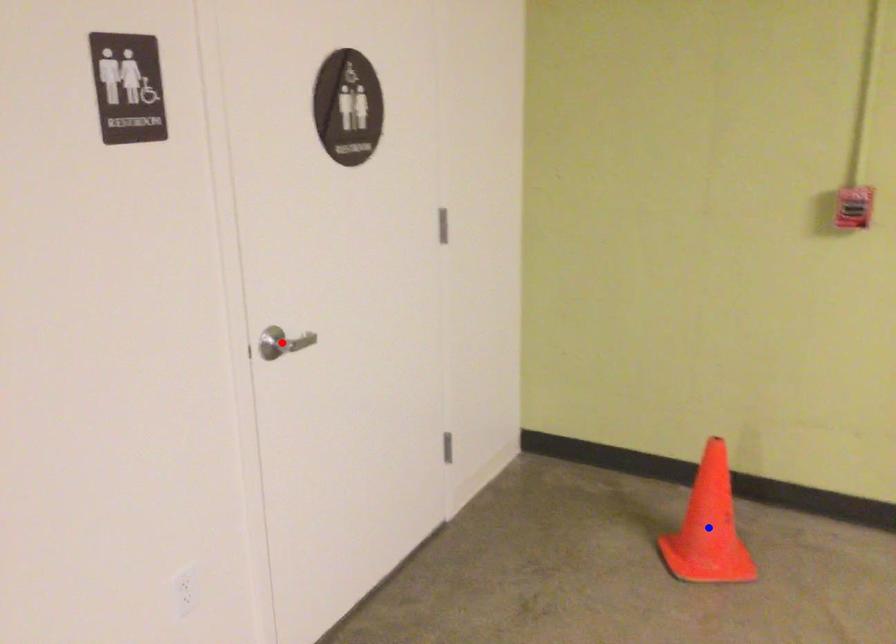
Question: Two points are marked on the image. Which point is closer to the camera?

Choices:
 (A) Blue point is closer.
 (B) Red point is closer.

Answer: (B)